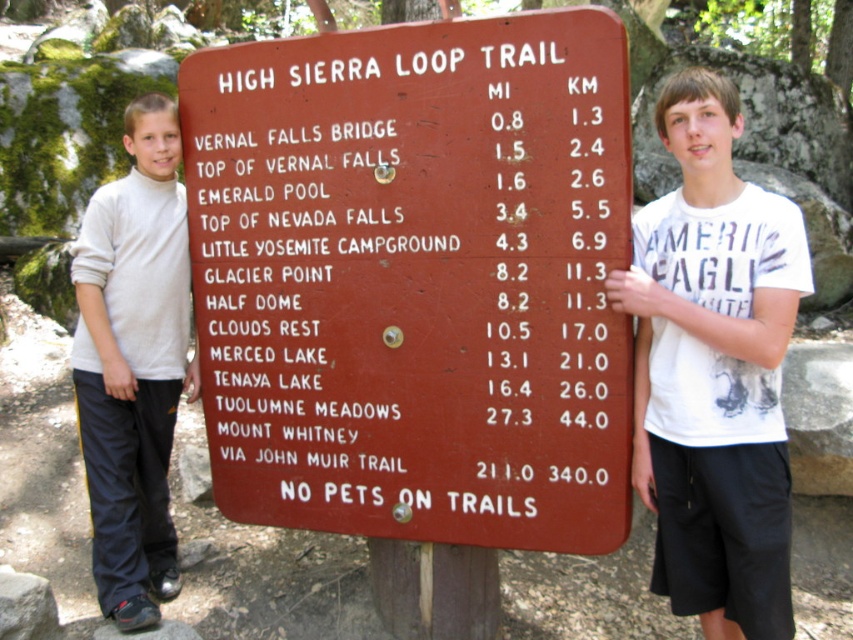
Question: Is white cotton t-shirt at center thinner than white turtleneck sweater at left?

Choices:
 (A) no
 (B) yes

Answer: (A)

Question: Is white cotton t-shirt at center positioned at the back of white turtleneck sweater at left?

Choices:
 (A) no
 (B) yes

Answer: (A)

Question: Which point appears farthest from the camera in this image?

Choices:
 (A) (653, 586)
 (B) (173, 115)

Answer: (B)

Question: Does white cotton t-shirt at center have a larger size compared to white turtleneck sweater at left?

Choices:
 (A) no
 (B) yes

Answer: (A)

Question: Estimate the real-world distances between objects in this image. Which object is farther from the white cotton t-shirt at center?

Choices:
 (A) white turtleneck sweater at left
 (B) brown wooden sign at center

Answer: (A)

Question: Among these objects, which one is nearest to the camera?

Choices:
 (A) white cotton t-shirt at center
 (B) brown wooden sign at center

Answer: (A)